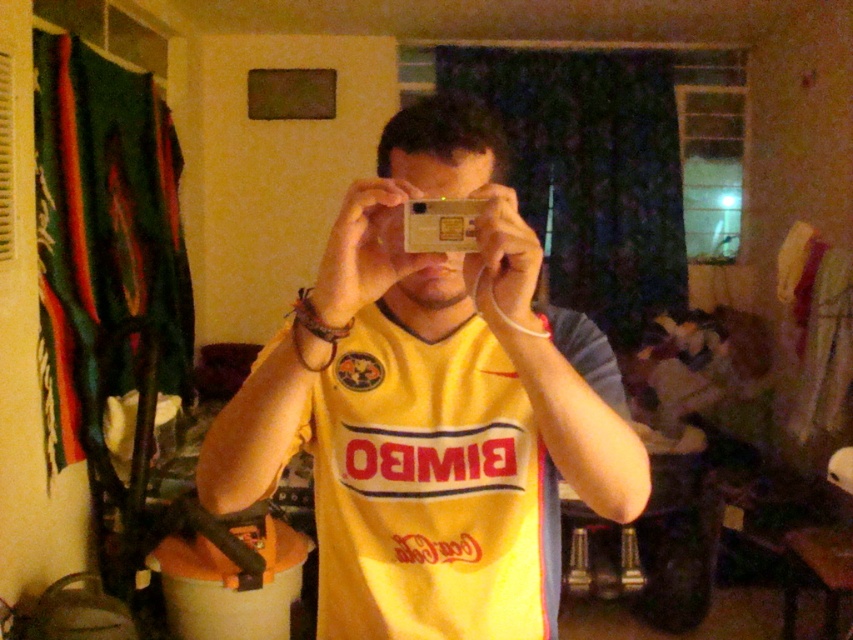
You are a photographer trying to capture the reflection of the yellow jersey at center and the metallic gold card at center in a mirror. Which object should you adjust first to ensure both are visible in the mirror?

The yellow jersey at center is positioned on the left side of the metallic gold card at center. To ensure both are visible in the mirror, you should adjust the metallic gold card at center first since it is on the right side and might be blocking the reflection of the jersey.

You are standing in the room and want to move from point A to point B. Point A is at coordinates point [306,317] and point B is at coordinates point [445,221]. Which point is closer to you?

Point A at coordinates point [306,317] is closer to you because it is further to the viewer than point B at coordinates point [445,221].

You are a photographer trying to capture a closeup of the yellow jersey at center and the metallic gold card at center in the image. Given that your camera can only focus on objects within a 20 cm range, will both items be in focus?

The distance between the yellow jersey at center and the metallic gold card at center is 22.75 centimeters, which exceeds the camera focus range of 20 cm. Therefore, both items might not be in focus simultaneously.